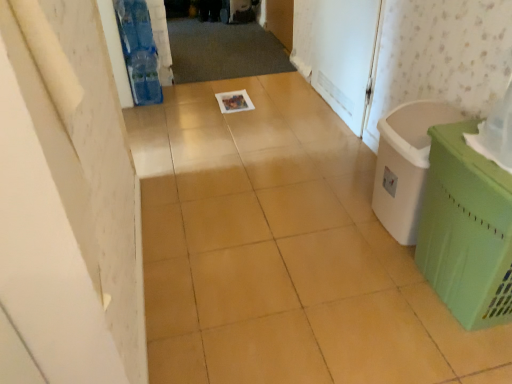
What do you see at coordinates (345, 56) in the screenshot? I see `white matte screen door at upper right` at bounding box center [345, 56].

The height and width of the screenshot is (384, 512). Identify the location of green plastic basket at right. [466, 229].

Is white matte screen door at upper right positioned beyond the bounds of green plastic basket at right?

white matte screen door at upper right is positioned outside green plastic basket at right.

Is white matte screen door at upper right to the left or to the right of green plastic basket at right in the image?

Clearly, white matte screen door at upper right is on the left of green plastic basket at right in the image.

Which is more distant, [336,8] or [481,298]?

The point [336,8] is farther from the camera.

From the image's perspective, is green plastic basket at right beneath white matte screen door at upper right?

Yes, from the image's perspective, green plastic basket at right is beneath white matte screen door at upper right.

From a real-world perspective, is green plastic basket at right above or below white matte screen door at upper right?

In terms of real-world spatial position, green plastic basket at right is below white matte screen door at upper right.

How many degrees apart are the facing directions of green plastic basket at right and white matte screen door at upper right?

There is a 1.28-degree angle between the facing directions of green plastic basket at right and white matte screen door at upper right.

Is green plastic basket at right looking in the opposite direction of green plastic laundry basket at right?

No.

In terms of height, does green plastic basket at right look taller or shorter compared to green plastic laundry basket at right?

In the image, green plastic basket at right appears to be taller than green plastic laundry basket at right.

Considering the points (451, 233) and (419, 159), which point is in front, point (451, 233) or point (419, 159)?

Positioned in front is point (451, 233).

Locate an element on the screen. This screenshot has height=384, width=512. laundry basket located underneath the green plastic basket at right (from a real-world perspective) is located at coordinates (405, 164).

Considering the sizes of objects green plastic laundry basket at right and green plastic basket at right in the image provided, who is smaller, green plastic laundry basket at right or green plastic basket at right?

With smaller size is green plastic laundry basket at right.

From a real-world perspective, is green plastic laundry basket at right positioned above or below green plastic basket at right?

→ In terms of real-world spatial position, green plastic laundry basket at right is below green plastic basket at right.

Which object is further away from the camera taking this photo, green plastic laundry basket at right or green plastic basket at right?

green plastic laundry basket at right is further away from the camera.

From the image's perspective, is white matte screen door at upper right on top of green plastic laundry basket at right?

Yes, from the image's perspective, white matte screen door at upper right is above green plastic laundry basket at right.

Where is `laundry basket in front of the white matte screen door at upper right`? The width and height of the screenshot is (512, 384). laundry basket in front of the white matte screen door at upper right is located at coordinates (405, 164).

Considering the relative sizes of white matte screen door at upper right and green plastic laundry basket at right in the image provided, is white matte screen door at upper right smaller than green plastic laundry basket at right?

Yes.

Is green plastic laundry basket at right aimed at white matte screen door at upper right?

No, green plastic laundry basket at right does not turn towards white matte screen door at upper right.

What are the coordinates of `laundry basket to the right of white matte screen door at upper right` in the screenshot? It's located at (405, 164).

Based on the photo, which object is positioned more to the left, green plastic laundry basket at right or white matte screen door at upper right?

Positioned to the left is white matte screen door at upper right.

Locate an element on the screen. The height and width of the screenshot is (384, 512). screen door that appears above the green plastic basket at right (from a real-world perspective) is located at coordinates (x=345, y=56).

Image resolution: width=512 pixels, height=384 pixels. Find the location of `waste container below the white matte screen door at upper right (from a real-world perspective)`. waste container below the white matte screen door at upper right (from a real-world perspective) is located at coordinates (466, 229).

Estimate the real-world distances between objects in this image. Which object is further from green plastic basket at right, green plastic laundry basket at right or white matte screen door at upper right?

Among the two, white matte screen door at upper right is located further to green plastic basket at right.

Considering their positions, is green plastic basket at right positioned further to green plastic laundry basket at right than white matte screen door at upper right?

The object further to green plastic laundry basket at right is white matte screen door at upper right.

Which object lies further to the anchor point green plastic basket at right, white matte screen door at upper right or green plastic laundry basket at right?

Based on the image, white matte screen door at upper right appears to be further to green plastic basket at right.

In the scene shown: Based on their spatial positions, is white matte screen door at upper right or green plastic basket at right closer to green plastic laundry basket at right?

Among the two, green plastic basket at right is located nearer to green plastic laundry basket at right.

Considering their positions, is green plastic laundry basket at right positioned further to white matte screen door at upper right than green plastic basket at right?

Among the two, green plastic basket at right is located further to white matte screen door at upper right.

Based on their spatial positions, is green plastic basket at right or green plastic laundry basket at right further from white matte screen door at upper right?

The object further to white matte screen door at upper right is green plastic basket at right.

Find the location of a particular element. The image size is (512, 384). laundry basket located between green plastic basket at right and white matte screen door at upper right in the depth direction is located at coordinates (405, 164).